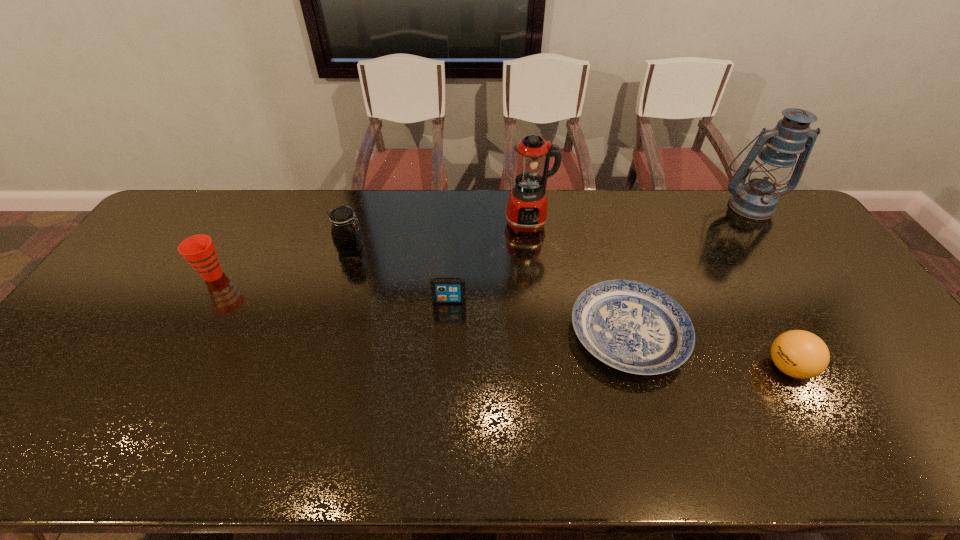
Where is `food processor at the far edge`? food processor at the far edge is located at coordinates (527, 207).

Where is `object that is at the right edge`? object that is at the right edge is located at coordinates (757, 199).

At what (x,y) coordinates should I click in order to perform the action: click on object positioned at the far right corner. Please return your answer as a coordinate pair (x, y). The image size is (960, 540). Looking at the image, I should click on (757, 199).

What are the coordinates of `free space at the far edge of the desktop` in the screenshot? It's located at (570, 229).

Where is `vacant space at the near edge`? The height and width of the screenshot is (540, 960). vacant space at the near edge is located at coordinates (396, 465).

Locate an element on the screen. vacant space at the left edge of the desktop is located at coordinates (126, 287).

Find the location of a particular element. This screenshot has width=960, height=540. vacant area at the right edge of the desktop is located at coordinates (814, 309).

You are a GUI agent. You are given a task and a screenshot of the screen. Output one action in this format:
    pyautogui.click(x=<x>, y=<y>)
    Task: Click on the free space between the leftmost object and the lantern
    The height and width of the screenshot is (540, 960).
    Given the screenshot: What is the action you would take?
    pyautogui.click(x=482, y=240)

In order to click on vacant area that lies between the cup and the plate in this screenshot , I will do pos(420,304).

Locate an element on the screen. unoccupied position between the second object from right to left and the jar is located at coordinates [569, 307].